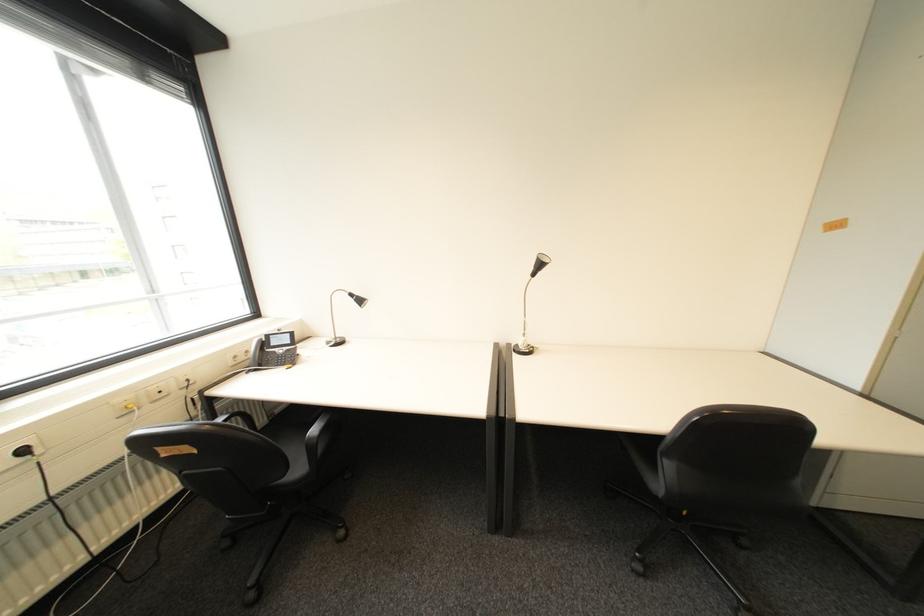
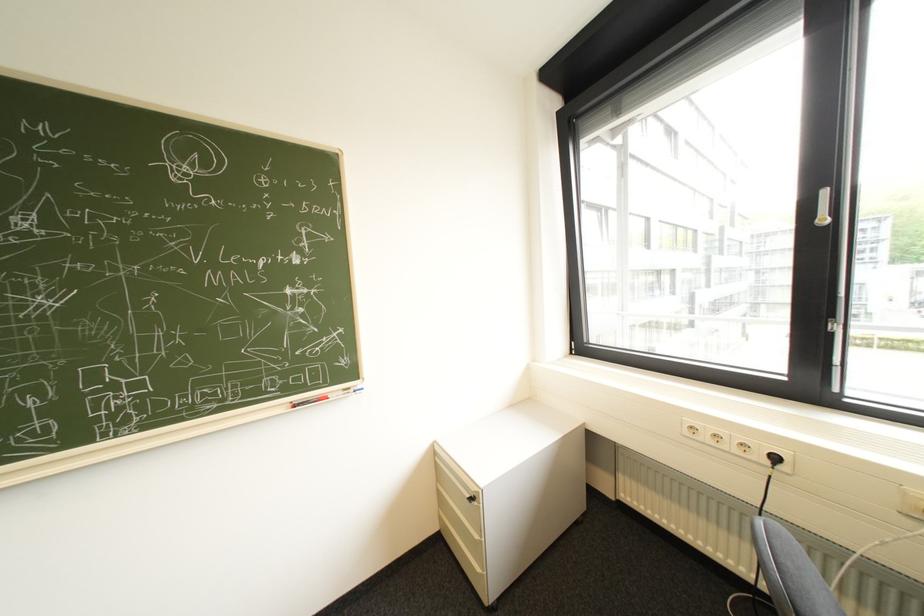
In the second image, find the point that corresponds to (29,461) in the first image.

(779, 463)